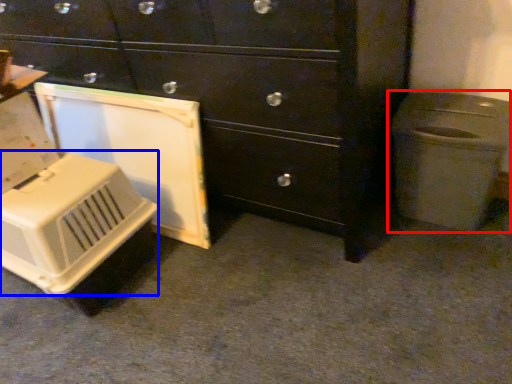
Question: Among these objects, which one is farthest to the camera, waste container (highlighted by a red box) or appliance (highlighted by a blue box)?

Choices:
 (A) waste container
 (B) appliance

Answer: (A)